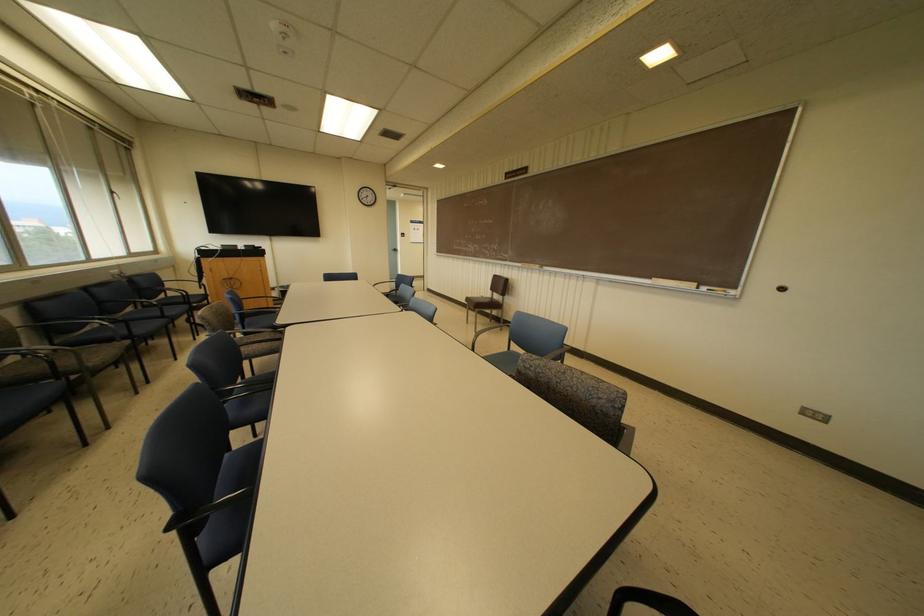
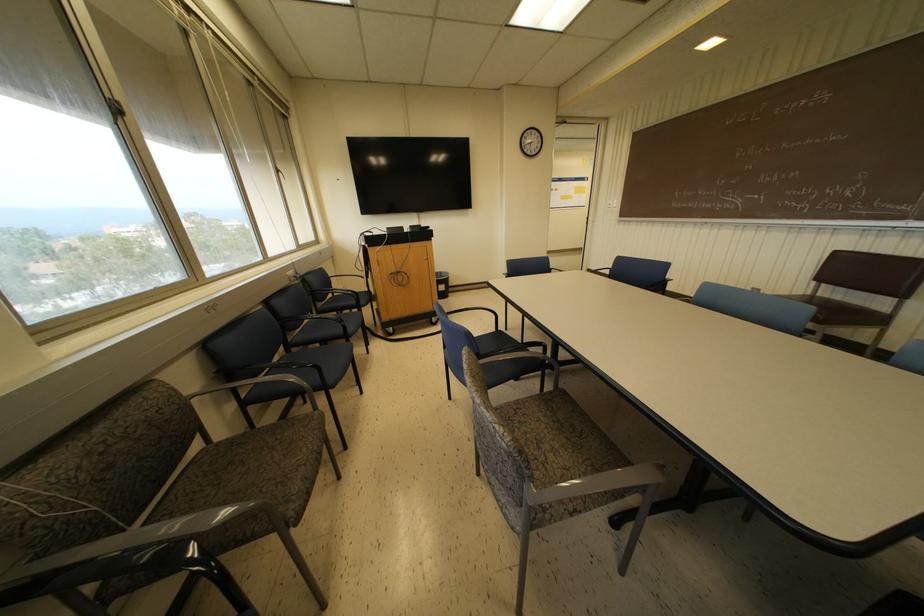
The images are taken continuously from a first-person perspective. In which direction are you moving?

The cameraman moved toward left, forward.